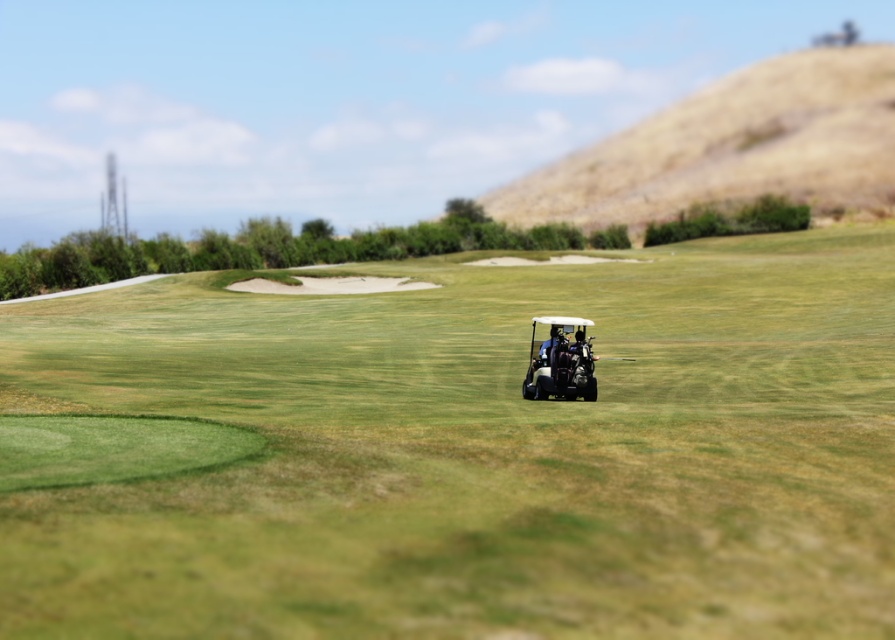
You are standing at the golf cart and want to walk to the barren hill. There are two points marked on the path. Which point is closer to you, point (743, 81) or point (592, 400)?

Point (592, 400) is closer to you because it is less further to the camera than point (743, 81).

You are a golfer standing near the matte black golf cart at center and want to reach the dried grass hill at upper right. Which direction should you go to get there?

The dried grass hill at upper right is located at the upper right side of the image, so you should move towards the upper right direction to reach it.

You are a golfer planning to drive your cart from the starting point to the sand trap on the left. The white plastic golf cart at center is blocking your path. Can you go around it by moving to the right side of the dried grass hill at upper right?

The white plastic golf cart at center is positioned on the left side of dried grass hill at upper right, so you can go around it by moving to the right side of the dried grass hill at upper right.